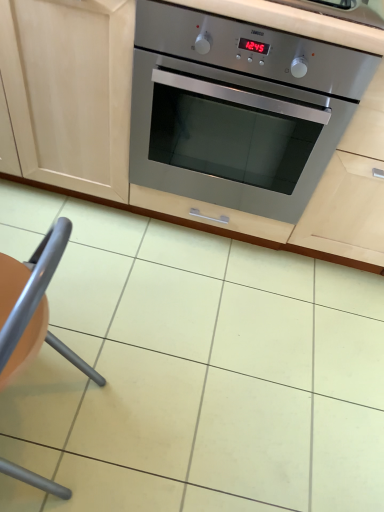
Question: Is orange plastic chair at lower left thinner than stainless steel oven at center?

Choices:
 (A) no
 (B) yes

Answer: (B)

Question: From a real-world perspective, is orange plastic chair at lower left under stainless steel oven at center?

Choices:
 (A) yes
 (B) no

Answer: (A)

Question: Does orange plastic chair at lower left have a larger size compared to stainless steel oven at center?

Choices:
 (A) yes
 (B) no

Answer: (B)

Question: From the image's perspective, is orange plastic chair at lower left under stainless steel oven at center?

Choices:
 (A) yes
 (B) no

Answer: (A)

Question: Is orange plastic chair at lower left to the right of stainless steel oven at center from the viewer's perspective?

Choices:
 (A) no
 (B) yes

Answer: (A)

Question: Is orange plastic chair at lower left positioned far away from stainless steel oven at center?

Choices:
 (A) yes
 (B) no

Answer: (B)

Question: From the image's perspective, would you say stainless steel oven at center is shown under orange plastic chair at lower left?

Choices:
 (A) yes
 (B) no

Answer: (B)

Question: Would you say stainless steel oven at center is a long distance from orange plastic chair at lower left?

Choices:
 (A) yes
 (B) no

Answer: (B)

Question: Is stainless steel oven at center looking in the opposite direction of orange plastic chair at lower left?

Choices:
 (A) no
 (B) yes

Answer: (B)

Question: Can you confirm if stainless steel oven at center is wider than orange plastic chair at lower left?

Choices:
 (A) yes
 (B) no

Answer: (A)

Question: Could you tell me if stainless steel oven at center is turned towards orange plastic chair at lower left?

Choices:
 (A) no
 (B) yes

Answer: (B)

Question: Does stainless steel oven at center have a greater height compared to orange plastic chair at lower left?

Choices:
 (A) yes
 (B) no

Answer: (A)

Question: Considering the positions of point (36, 264) and point (104, 185), is point (36, 264) closer or farther from the camera than point (104, 185)?

Choices:
 (A) farther
 (B) closer

Answer: (B)